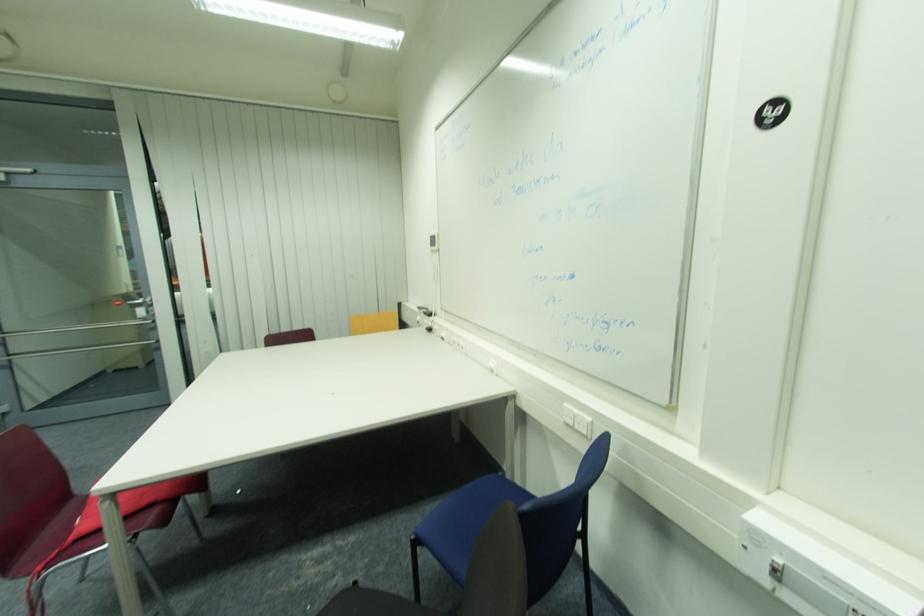
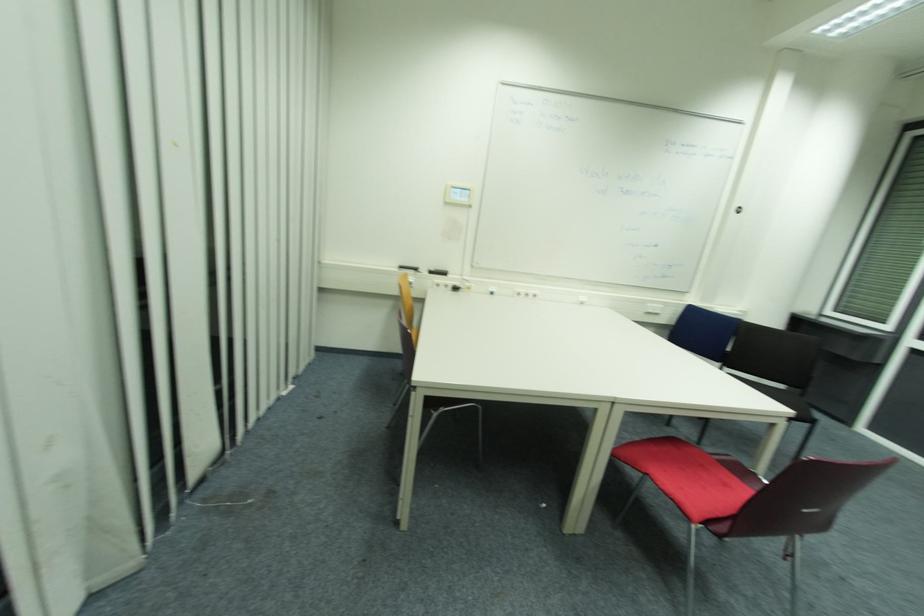
Where in the second image is the point corresponding to (x=433, y=331) from the first image?

(458, 290)